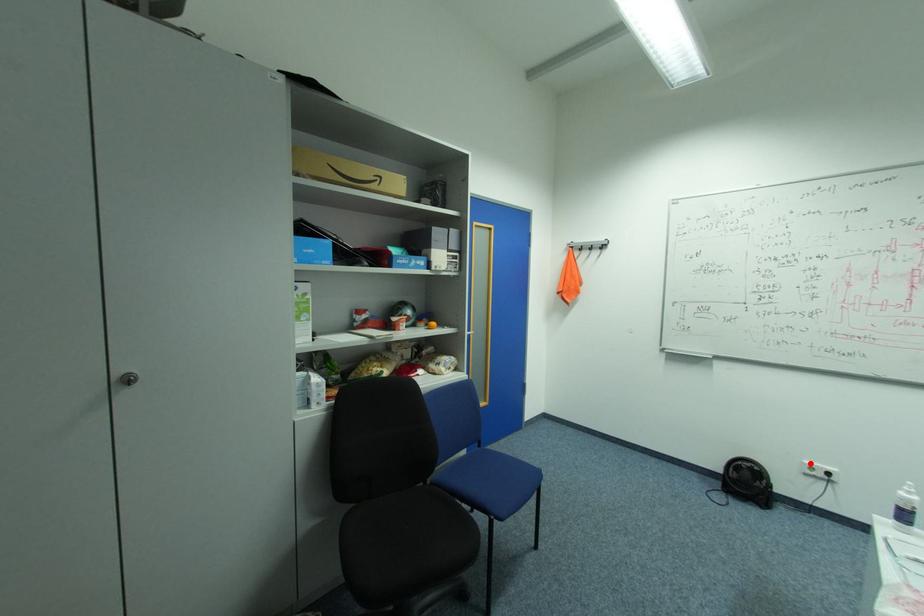
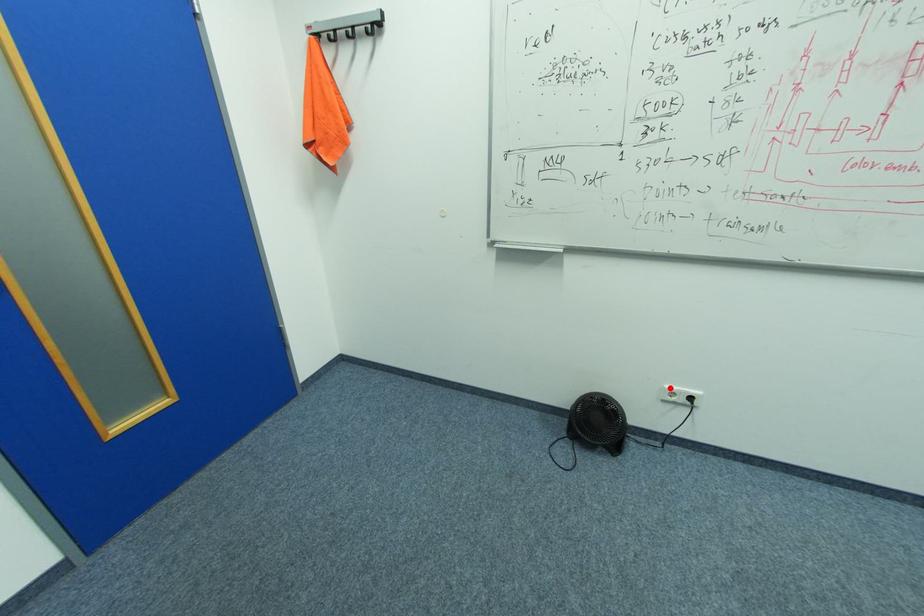
I am providing you with two images of the same scene from different viewpoints. A red point is marked on the first image and another point is marked on the second image. Do the highlighted points in image1 and image2 indicate the same real-world spot?

Yes